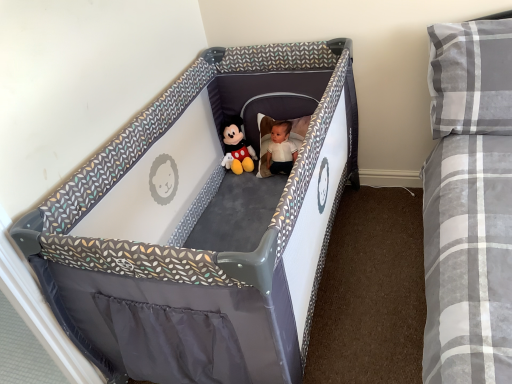
Question: Should I look upward or downward to see gray fabric playpen at center?

Choices:
 (A) up
 (B) down

Answer: (B)

Question: Is gray plaid pillow at upper right to the right of gray fabric playpen at center from the viewer's perspective?

Choices:
 (A) no
 (B) yes

Answer: (B)

Question: Does gray plaid pillow at upper right have a smaller size compared to gray fabric playpen at center?

Choices:
 (A) yes
 (B) no

Answer: (B)

Question: From a real-world perspective, is gray plaid pillow at upper right beneath gray fabric playpen at center?

Choices:
 (A) no
 (B) yes

Answer: (A)

Question: Does gray plaid pillow at upper right have a greater height compared to gray fabric playpen at center?

Choices:
 (A) yes
 (B) no

Answer: (A)

Question: From the image's perspective, would you say gray plaid pillow at upper right is positioned over gray fabric playpen at center?

Choices:
 (A) yes
 (B) no

Answer: (A)

Question: Is gray plaid pillow at upper right positioned in front of gray fabric playpen at center?

Choices:
 (A) no
 (B) yes

Answer: (A)

Question: From a real-world perspective, is gray fabric playpen at center located higher than gray plaid pillow at upper right?

Choices:
 (A) no
 (B) yes

Answer: (A)

Question: Is gray fabric playpen at center far away from gray plaid pillow at upper right?

Choices:
 (A) yes
 (B) no

Answer: (B)

Question: Would you say gray plaid pillow at upper right is part of gray fabric playpen at center's contents?

Choices:
 (A) no
 (B) yes

Answer: (A)

Question: Is gray fabric playpen at center positioned with its back to gray plaid pillow at upper right?

Choices:
 (A) yes
 (B) no

Answer: (B)

Question: Is gray fabric playpen at center to the left of gray plaid pillow at upper right from the viewer's perspective?

Choices:
 (A) no
 (B) yes

Answer: (B)

Question: Can you confirm if gray fabric playpen at center is bigger than gray plaid pillow at upper right?

Choices:
 (A) yes
 (B) no

Answer: (B)

Question: Considering the relative sizes of soft plush mickey mouse at center and gray plaid pillow at upper right in the image provided, is soft plush mickey mouse at center wider than gray plaid pillow at upper right?

Choices:
 (A) yes
 (B) no

Answer: (B)